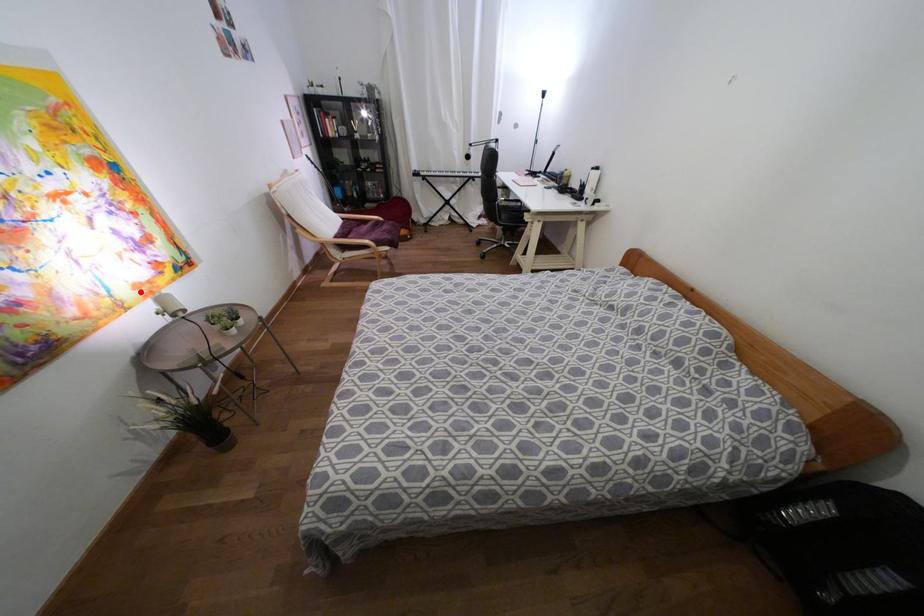
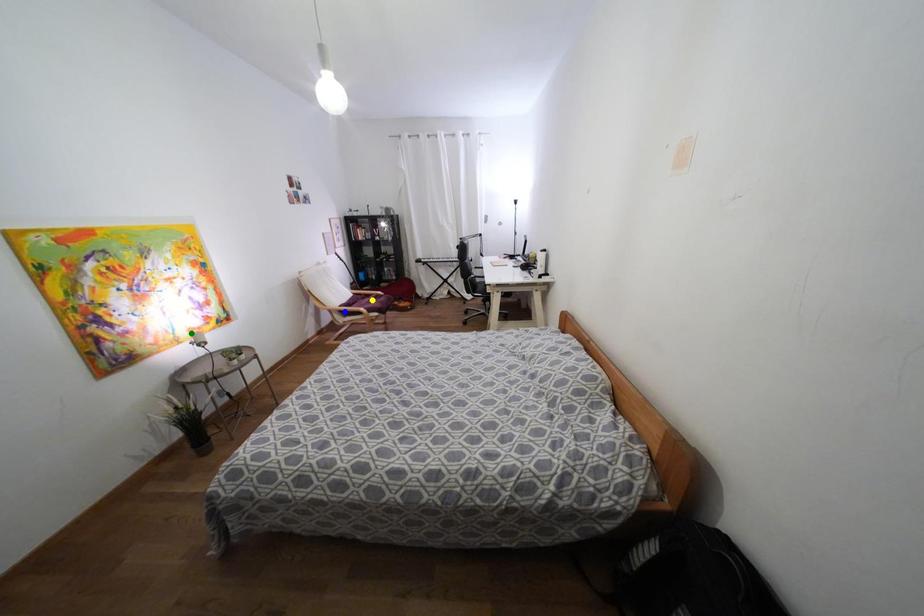
Question: I am providing you with two images of the same scene from different viewpoints. A red point is marked on the first image. You are given multiple points on the second image. Which mark in image 2 goes with the point in image 1?

Choices:
 (A) blue point
 (B) green point
 (C) yellow point

Answer: (B)